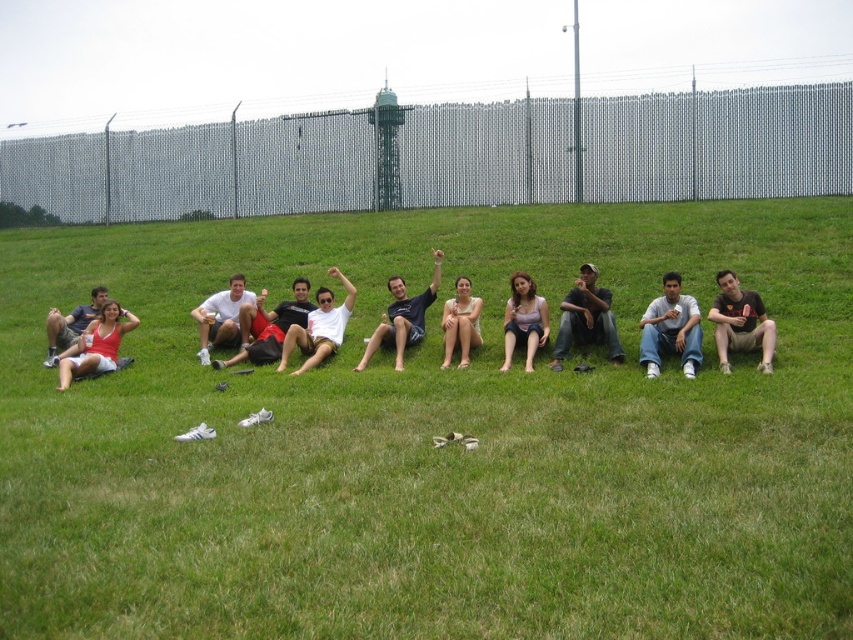
You are part of the group sitting on the grassy hill and want to hand a drink to the person wearing the matte white shirt at center and the matte pink shirt at center. If you are standing directly in front of the semi circle, which direction should you move to reach both of them first?

Since the matte white shirt at center is to the left of the matte pink shirt at center, you should move to the left to reach the matte white shirt at center first, and then move right to reach the matte pink shirt at center.

Based on the coordinates provided, where is the matte red tank top at left located in the image?

The matte red tank top at left is located at the coordinates point (96, 344).

You are standing at the center of the grassy hill and want to find the matte red tank top at left. Which direction should you look to locate it?

The matte red tank top at left is located at point (96, 344), so you should look to your left side to find it.